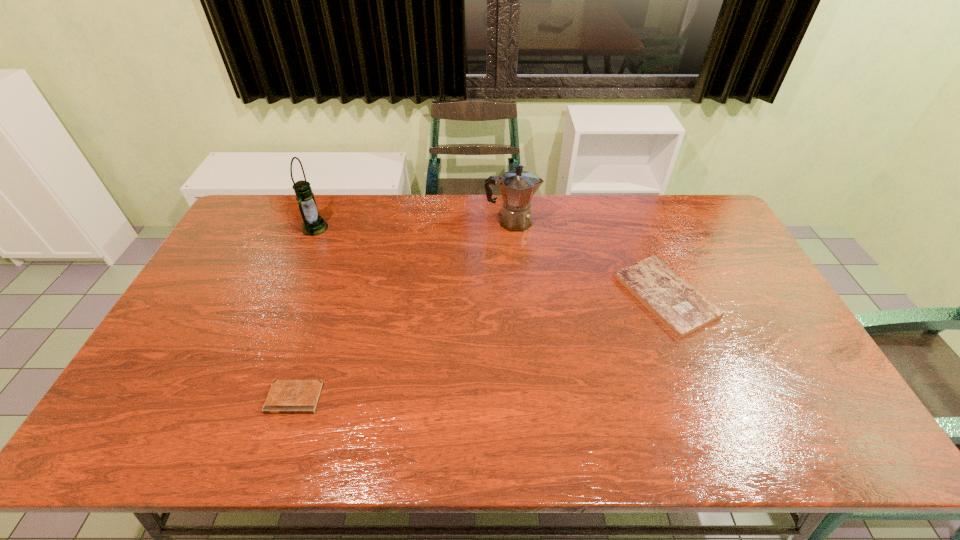
Image resolution: width=960 pixels, height=540 pixels. I want to click on lantern, so click(313, 224).

You are a GUI agent. You are given a task and a screenshot of the screen. Output one action in this format:
    pyautogui.click(x=<x>, y=<y>)
    Task: Click on the leftmost object
    This screenshot has width=960, height=540.
    Given the screenshot: What is the action you would take?
    pyautogui.click(x=313, y=224)

Where is `the third shortest object`? the third shortest object is located at coordinates (517, 187).

The image size is (960, 540). In order to click on coffeepot in this screenshot , I will do `click(517, 187)`.

Where is `Bible`? Bible is located at coordinates (679, 306).

Find the location of a particular element. This screenshot has height=540, width=960. the second nearest object is located at coordinates (679, 306).

The image size is (960, 540). What are the coordinates of `diary` in the screenshot? It's located at (285, 396).

Where is `the nearest object`? the nearest object is located at coordinates (285, 396).

What are the coordinates of `vacant area located on the side where the tallest object emits light` in the screenshot? It's located at (381, 228).

In order to click on free location located 0.100m on the pouring side of the second tallest object in this screenshot , I will do `click(567, 221)`.